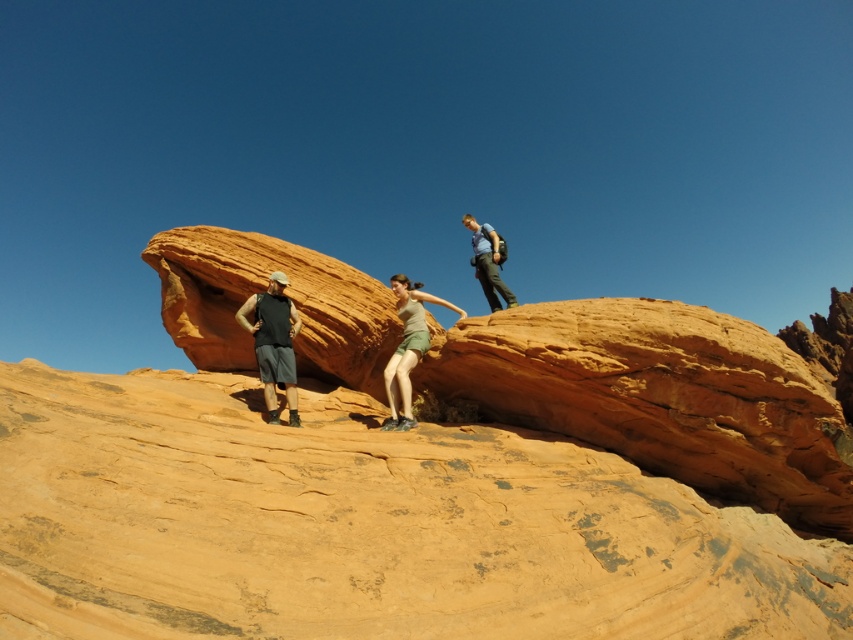
Question: Can you confirm if matte green shorts at center is positioned to the right of matte blue shirt at upper center?

Choices:
 (A) yes
 (B) no

Answer: (B)

Question: Considering the relative positions of matte green shorts at center and matte blue shirt at upper center in the image provided, where is matte green shorts at center located with respect to matte blue shirt at upper center?

Choices:
 (A) right
 (B) left

Answer: (B)

Question: Does matte black tank top at center appear on the left side of matte blue shirt at upper center?

Choices:
 (A) no
 (B) yes

Answer: (B)

Question: Which is farther from the matte blue shirt at upper center?

Choices:
 (A) matte black tank top at center
 (B) matte green shorts at center

Answer: (A)

Question: Which of these objects is positioned closest to the matte green shorts at center?

Choices:
 (A) matte blue shirt at upper center
 (B) matte black tank top at center

Answer: (A)

Question: Which is nearer to the matte blue shirt at upper center?

Choices:
 (A) matte green shorts at center
 (B) matte black tank top at center

Answer: (A)